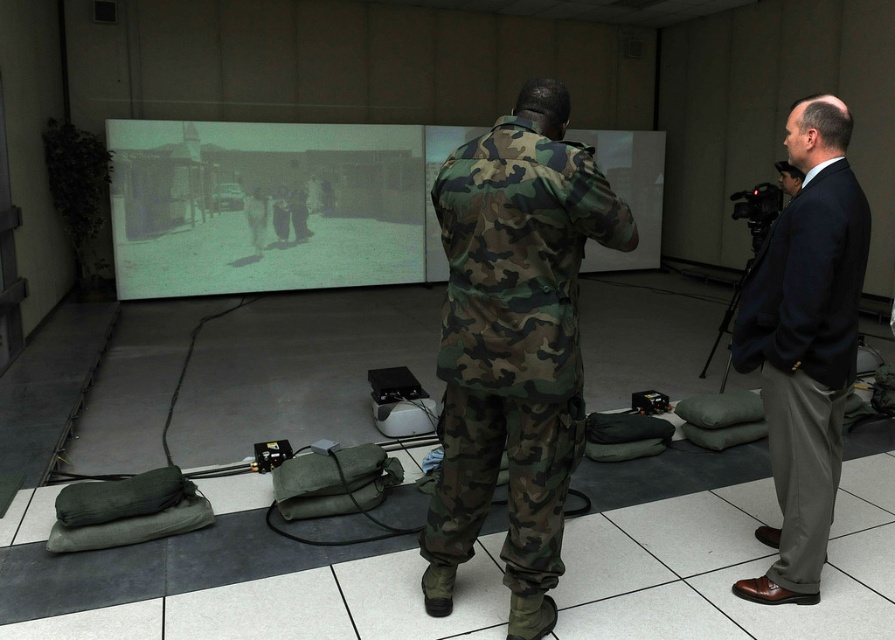
Image resolution: width=895 pixels, height=640 pixels. What do you see at coordinates (513, 344) in the screenshot?
I see `camo fabric uniform at center` at bounding box center [513, 344].

Between camo fabric uniform at center and dark blue suit at right, which one has less height?

With less height is dark blue suit at right.

Where is `camo fabric uniform at center`? camo fabric uniform at center is located at coordinates (513, 344).

Does gray matte projection screen at center lie behind dark suit at right?

Yes, it is behind dark suit at right.

Between gray matte projection screen at center and dark suit at right, which one has less height?

dark suit at right is shorter.

Does point (278, 179) come in front of point (791, 180)?

No, (278, 179) is further to viewer.

The width and height of the screenshot is (895, 640). Identify the location of gray matte projection screen at center. (263, 205).

Looking at this image, does black matte tripod at right have a greater height compared to dark suit at right?

Correct, black matte tripod at right is much taller as dark suit at right.

Is point (757, 256) positioned in front of point (794, 180)?

Yes, point (757, 256) is in front of point (794, 180).

Identify the location of black matte tripod at right. tap(736, 292).